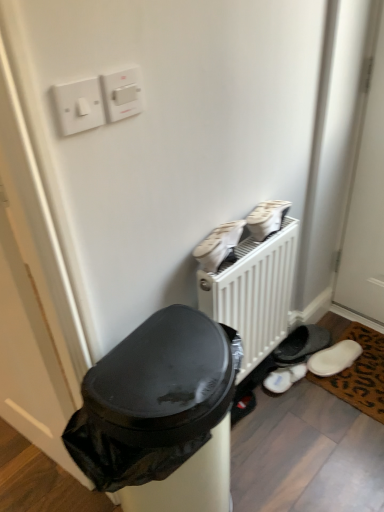
Question: From a real-world perspective, is white fabric shoes at upper right, positioned as the 2th footwear in front-to-back order, physically above white fabric shoes at center, which ranks as the second footwear in top-to-bottom order?

Choices:
 (A) no
 (B) yes

Answer: (A)

Question: Does white fabric shoes at upper right, acting as the third footwear starting from the bottom, have a greater height compared to white fabric shoes at center, acting as the second footwear starting from the bottom?

Choices:
 (A) no
 (B) yes

Answer: (A)

Question: Is white fabric shoes at upper right, placed as the 2th footwear when sorted from back to front, closer to camera compared to white fabric shoes at center, the third footwear positioned from the back?

Choices:
 (A) no
 (B) yes

Answer: (A)

Question: Could you tell me if white fabric shoes at upper right, positioned as the 2th footwear in front-to-back order, is facing white fabric shoes at center, which ranks as the second footwear in top-to-bottom order?

Choices:
 (A) no
 (B) yes

Answer: (A)

Question: Is white fabric shoes at upper right, positioned as the 2th footwear in front-to-back order, positioned behind white fabric shoes at center, the 1th footwear in the front-to-back sequence?

Choices:
 (A) yes
 (B) no

Answer: (A)

Question: From a real-world perspective, is white fabric shoes at upper right, arranged as the 1th footwear when viewed from the top, below white fabric shoes at center, the third footwear positioned from the back?

Choices:
 (A) yes
 (B) no

Answer: (A)

Question: Is white plastic light switch at upper left, positioned as the second light switch in right-to-left order, wider than white fabric shoes at center, acting as the second footwear starting from the bottom?

Choices:
 (A) no
 (B) yes

Answer: (A)

Question: Can you confirm if white plastic light switch at upper left, positioned as the second light switch in right-to-left order, is thinner than white fabric shoes at center, which ranks as the second footwear in top-to-bottom order?

Choices:
 (A) yes
 (B) no

Answer: (A)

Question: Can you confirm if white plastic light switch at upper left, positioned as the second light switch in right-to-left order, is bigger than white fabric shoes at center, acting as the second footwear starting from the bottom?

Choices:
 (A) yes
 (B) no

Answer: (B)

Question: Would you consider white plastic light switch at upper left, positioned as the second light switch in right-to-left order, to be distant from white fabric shoes at center, acting as the second footwear starting from the bottom?

Choices:
 (A) no
 (B) yes

Answer: (A)

Question: From the image's perspective, is white plastic light switch at upper left, which appears as the 1th light switch when viewed from the left, located beneath white fabric shoes at center, which ranks as the second footwear in top-to-bottom order?

Choices:
 (A) no
 (B) yes

Answer: (A)

Question: Can you confirm if white plastic light switch at upper left, positioned as the second light switch in right-to-left order, is smaller than white fabric shoes at center, the 1th footwear in the front-to-back sequence?

Choices:
 (A) yes
 (B) no

Answer: (A)

Question: Could brown leopard print mat at lower right be considered to be inside white fluffy slippers at lower right, placed as the first footwear when sorted from bottom to top?

Choices:
 (A) no
 (B) yes

Answer: (A)